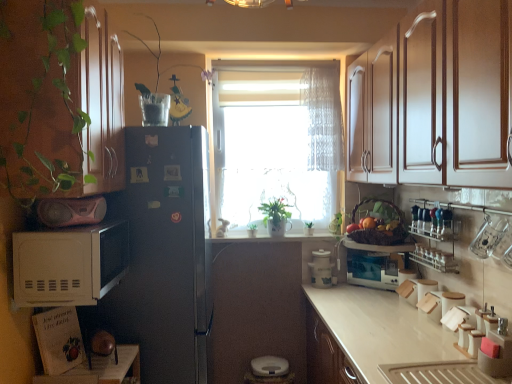
Question: Is clear glass bottles at upper right smaller than white plastic container at center, which is the 2th appliance from left to right?

Choices:
 (A) no
 (B) yes

Answer: (A)

Question: Is the depth of clear glass bottles at upper right less than that of white plastic container at center, positioned as the 1th appliance in back-to-front order?

Choices:
 (A) yes
 (B) no

Answer: (A)

Question: Is clear glass bottles at upper right shorter than white plastic container at center, the third appliance when ordered from right to left?

Choices:
 (A) no
 (B) yes

Answer: (A)

Question: Is clear glass bottles at upper right at the left side of white plastic container at center, which ranks as the 2th appliance in top-to-bottom order?

Choices:
 (A) yes
 (B) no

Answer: (B)

Question: From a real-world perspective, is clear glass bottles at upper right on white plastic container at center, which ranks as the 2th appliance in top-to-bottom order?

Choices:
 (A) yes
 (B) no

Answer: (A)

Question: Is white plastic container at center, which ranks as the 2th appliance in top-to-bottom order, surrounded by clear glass bottles at upper right?

Choices:
 (A) yes
 (B) no

Answer: (B)

Question: Is white plastic container at center, the third appliance positioned from the bottom, positioned before clear glass bottles at upper right?

Choices:
 (A) no
 (B) yes

Answer: (A)

Question: From the image's perspective, is white plastic container at center, acting as the fourth appliance starting from the front, on top of clear glass bottles at upper right?

Choices:
 (A) yes
 (B) no

Answer: (B)

Question: Is white plastic container at center, positioned as the 1th appliance in back-to-front order, to the left of clear glass bottles at upper right from the viewer's perspective?

Choices:
 (A) no
 (B) yes

Answer: (B)

Question: Is white plastic container at center, positioned as the 1th appliance in back-to-front order, bigger than clear glass bottles at upper right?

Choices:
 (A) yes
 (B) no

Answer: (B)

Question: Is white plastic container at center, the third appliance positioned from the bottom, aimed at clear glass bottles at upper right?

Choices:
 (A) no
 (B) yes

Answer: (A)

Question: Would you say white plastic container at center, acting as the fourth appliance starting from the front, is outside clear glass bottles at upper right?

Choices:
 (A) no
 (B) yes

Answer: (B)

Question: Can you confirm if translucent fabric curtain at center is wider than white matte microwave at left?

Choices:
 (A) yes
 (B) no

Answer: (B)